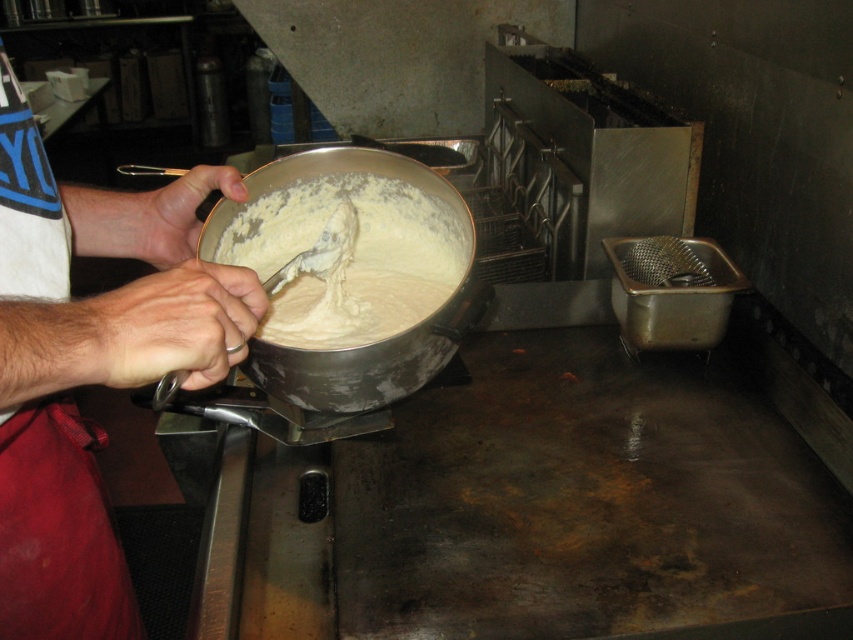
Who is shorter, white matte bowl at upper left or matte silver spoon at upper center?

With less height is matte silver spoon at upper center.

The width and height of the screenshot is (853, 640). In order to click on white matte bowl at upper left in this screenshot , I will do `click(90, 365)`.

Between creamy matte pot at center and smooth skin hand at center, which one has less height?

smooth skin hand at center is shorter.

In order to click on creamy matte pot at center in this screenshot , I will do `click(351, 259)`.

This screenshot has height=640, width=853. Identify the location of creamy matte pot at center. (351, 259).

Identify the location of creamy matte pot at center. (351, 259).

Where is `white matte bowl at upper left`? The height and width of the screenshot is (640, 853). white matte bowl at upper left is located at coordinates (90, 365).

Is point (74, 625) positioned after point (115, 339)?

Yes.

You are a GUI agent. You are given a task and a screenshot of the screen. Output one action in this format:
    pyautogui.click(x=<x>, y=<y>)
    Task: Click on the white matte bowl at upper left
    The image size is (853, 640).
    Given the screenshot: What is the action you would take?
    pyautogui.click(x=90, y=365)